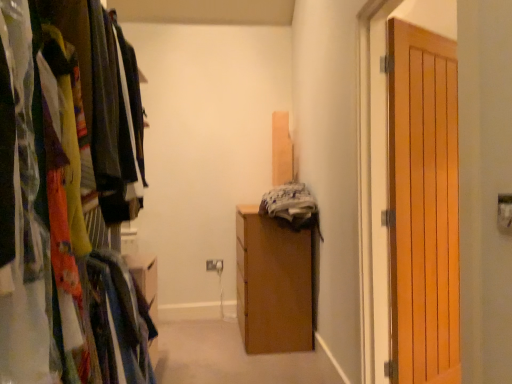
Locate an element on the screen. The image size is (512, 384). wooden door at right is located at coordinates (423, 205).

You are a GUI agent. You are given a task and a screenshot of the screen. Output one action in this format:
    pyautogui.click(x=<x>, y=<y>)
    Task: Click on the wooden wardrobe at left
    The image size is (512, 384).
    Given the screenshot: What is the action you would take?
    59,200

Is wooden cabinet at center wider than wooden wardrobe at left?

Yes.

From a real-world perspective, is wooden cabinet at center physically below wooden wardrobe at left?

Yes, from a real-world perspective, wooden cabinet at center is beneath wooden wardrobe at left.

Considering the points (194, 325) and (109, 85), which point is in front, point (194, 325) or point (109, 85)?

The point (109, 85) is more forward.

Do you think wooden cabinet at center is within wooden wardrobe at left, or outside of it?

wooden cabinet at center is outside wooden wardrobe at left.

Would you say wooden cabinet at center is part of wooden door at right's contents?

No.

Can you see wooden door at right touching wooden cabinet at center?

wooden door at right is not next to wooden cabinet at center, and they're not touching.

Does wooden door at right have a larger size compared to wooden cabinet at center?

No, wooden door at right is not bigger than wooden cabinet at center.

Looking at this image, from the image's perspective, which one is positioned higher, wooden wardrobe at left or wooden cabinet at center?

wooden wardrobe at left, from the image's perspective.

Based on the photo, considering the relative sizes of wooden wardrobe at left and wooden cabinet at center in the image provided, is wooden wardrobe at left shorter than wooden cabinet at center?

No.

The height and width of the screenshot is (384, 512). What are the coordinates of `path on the right side of wooden wardrobe at left` in the screenshot? It's located at (231, 358).

Between wooden wardrobe at left and wooden cabinet at center, which one has larger size?

wooden wardrobe at left is bigger.

Is wooden door at right aimed at wooden wardrobe at left?

No.

From the image's perspective, would you say wooden door at right is positioned over wooden wardrobe at left?

No, from the image's perspective, wooden door at right is not on top of wooden wardrobe at left.

From a real-world perspective, which is physically above, wooden door at right or wooden wardrobe at left?

wooden wardrobe at left, from a real-world perspective.

Is wooden door at right outside of wooden wardrobe at left?

Yes.

Considering the sizes of objects wooden cabinet at center and wooden door at right in the image provided, who is thinner, wooden cabinet at center or wooden door at right?

wooden door at right.

From the image's perspective, which one is positioned higher, wooden cabinet at center or wooden door at right?

wooden door at right.

Are wooden cabinet at center and wooden door at right far apart?

That's right, there is a large distance between wooden cabinet at center and wooden door at right.

Choose the correct answer: Is wooden wardrobe at left inside wooden door at right or outside it?

wooden wardrobe at left cannot be found inside wooden door at right.

From the image's perspective, is wooden wardrobe at left on wooden door at right?

Yes.

Who is taller, wooden wardrobe at left or wooden door at right?

With more height is wooden wardrobe at left.

Is point (7, 121) behind point (456, 188)?

No, it is not.

Locate an element on the screen. The height and width of the screenshot is (384, 512). cabinetry above the wooden cabinet at center (from a real-world perspective) is located at coordinates (59, 200).

Locate an element on the screen. This screenshot has height=384, width=512. path that is below the wooden door at right (from the image's perspective) is located at coordinates (231, 358).

From the image, which object appears to be nearer to wooden door at right, wooden wardrobe at left or wooden cabinet at center?

wooden cabinet at center.

Which object lies nearer to the anchor point wooden wardrobe at left, wooden cabinet at center or wooden door at right?

Based on the image, wooden door at right appears to be nearer to wooden wardrobe at left.

From the image, which object appears to be nearer to wooden door at right, wooden cabinet at center or wooden wardrobe at left?

Based on the image, wooden cabinet at center appears to be nearer to wooden door at right.

Looking at the image, which one is located closer to wooden cabinet at center, wooden wardrobe at left or wooden door at right?

Among the two, wooden door at right is located nearer to wooden cabinet at center.

Considering their positions, is wooden door at right positioned closer to wooden wardrobe at left than wooden cabinet at center?

The object closer to wooden wardrobe at left is wooden door at right.

Looking at the image, which one is located further to wooden cabinet at center, wooden door at right or wooden wardrobe at left?

wooden wardrobe at left lies further to wooden cabinet at center than the other object.

Where is `path between wooden wardrobe at left and wooden door at right from left to right`? This screenshot has width=512, height=384. path between wooden wardrobe at left and wooden door at right from left to right is located at coordinates (231, 358).